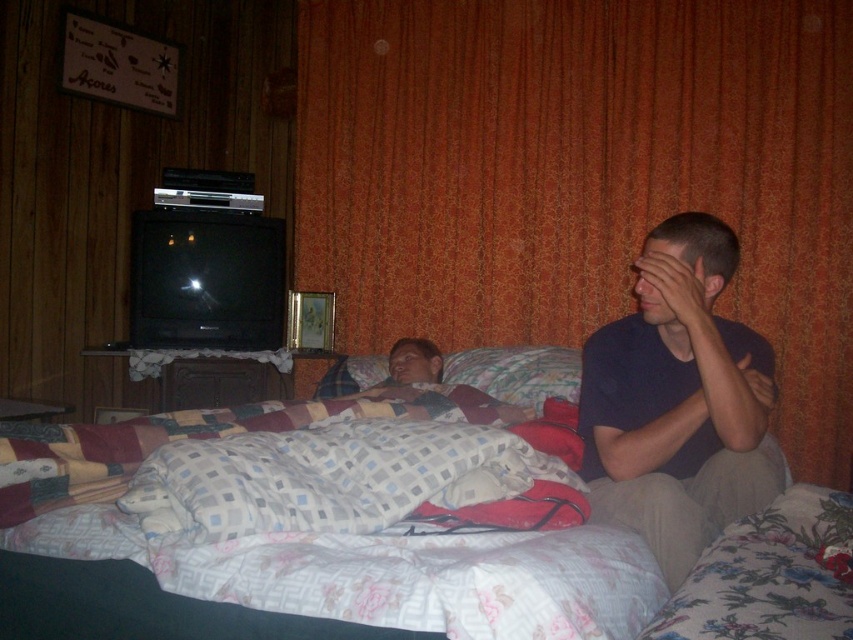
Question: Which of the following is the farthest from the observer?

Choices:
 (A) fluffy fabric pillow at center
 (B) orange textured curtain at upper center
 (C) dark blue shirt at center
 (D) fluffy cotton bed at center

Answer: (B)

Question: Which of the following is the farthest from the observer?

Choices:
 (A) dark blue shirt at center
 (B) fluffy fabric pillow at center
 (C) fluffy cotton bed at center

Answer: (B)

Question: Where is fluffy cotton bed at center located in relation to dark blue shirt at center in the image?

Choices:
 (A) left
 (B) right

Answer: (A)

Question: Is fluffy cotton bed at center bigger than dark blue shirt at center?

Choices:
 (A) yes
 (B) no

Answer: (A)

Question: Which point appears farthest from the camera in this image?

Choices:
 (A) (718, 520)
 (B) (329, 26)
 (C) (225, 588)
 (D) (375, 355)

Answer: (B)

Question: Considering the relative positions of dark blue shirt at center and fluffy fabric pillow at center in the image provided, where is dark blue shirt at center located with respect to fluffy fabric pillow at center?

Choices:
 (A) below
 (B) above

Answer: (A)